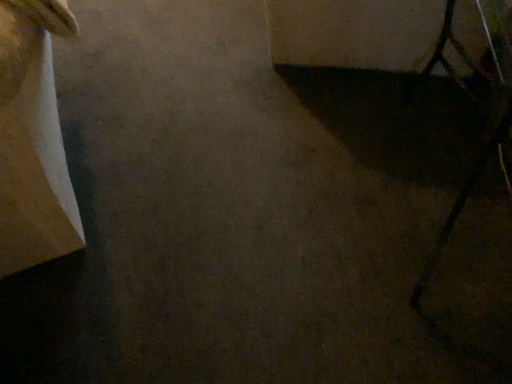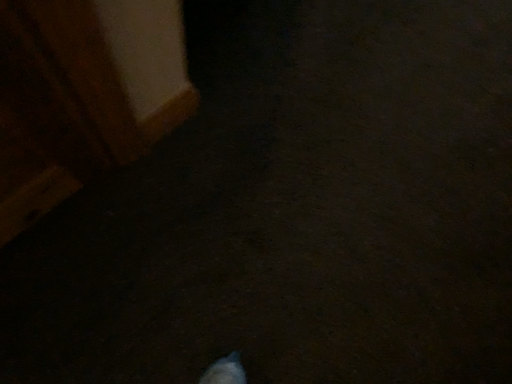
Question: How did the camera likely rotate when shooting the video?

Choices:
 (A) rotated left
 (B) rotated right

Answer: (A)